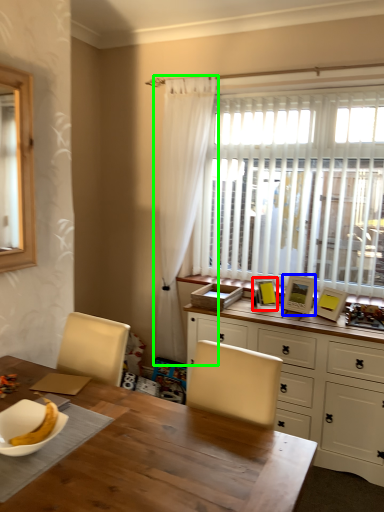
Question: Which object is the closest to the picture frame (highlighted by a red box)? Choose among these: picture frame (highlighted by a blue box) or curtain (highlighted by a green box).

Choices:
 (A) picture frame
 (B) curtain

Answer: (A)